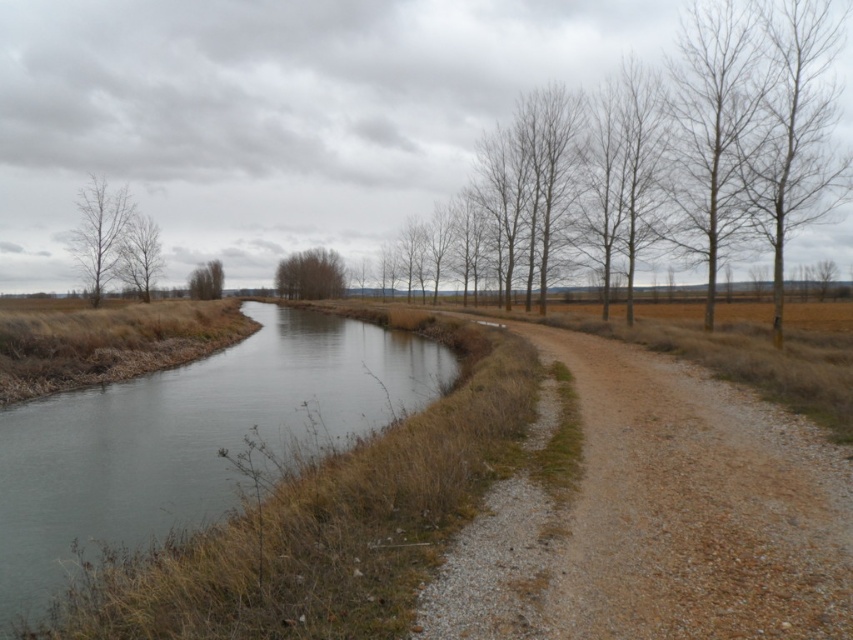
You are standing on the dirt path next to the brown grassy stream at left and the green leafy tree at upper center. Which object is taller when viewed from your position?

The green leafy tree at upper center is taller than the brown grassy stream at left.

You are standing on the dirt path next to the canal and want to walk towards the green leafy tree at upper center. Which direction should you walk to avoid the bare wood tree at left?

To reach the green leafy tree at upper center while avoiding the bare wood tree at left, you should walk towards the right side of the path since the bare wood tree at left is positioned under it, meaning it is closer to the left edge of the path.